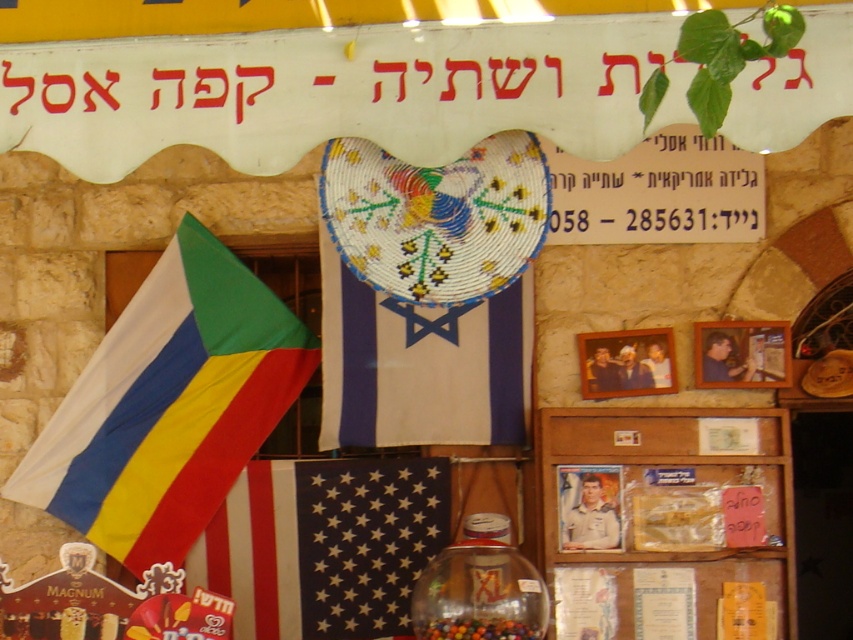
Who is higher up, multicolored fabric flag at left or white fabric flag at center?

multicolored fabric flag at left

Which is below, multicolored fabric flag at left or white fabric flag at center?

white fabric flag at center is lower down.

Find the location of a particular element. multicolored fabric flag at left is located at coordinates (169, 404).

Does multicolored fabric flag at left have a greater width compared to shiny plastic beads at center?

Yes, multicolored fabric flag at left is wider than shiny plastic beads at center.

Describe the element at coordinates (169, 404) in the screenshot. The height and width of the screenshot is (640, 853). I see `multicolored fabric flag at left` at that location.

Between point (238, 432) and point (434, 637), which one is positioned in front?

Positioned in front is point (434, 637).

Find the location of `multicolored fabric flag at left`. multicolored fabric flag at left is located at coordinates (169, 404).

How distant is beaded fabric flag at center from shiny plastic beads at center?

beaded fabric flag at center and shiny plastic beads at center are 3.91 feet apart from each other.

Which is below, beaded fabric flag at center or shiny plastic beads at center?

shiny plastic beads at center

Does point (372, 426) come farther from viewer compared to point (440, 624)?

That is True.

The width and height of the screenshot is (853, 640). I want to click on beaded fabric flag at center, so click(431, 296).